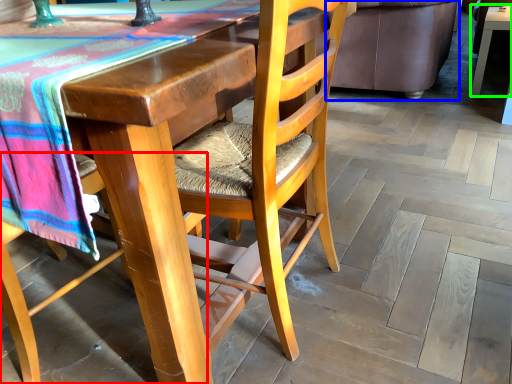
Question: Which object is the farthest from chair (highlighted by a red box)? Choose among these: couch (highlighted by a blue box) or table (highlighted by a green box).

Choices:
 (A) couch
 (B) table

Answer: (B)